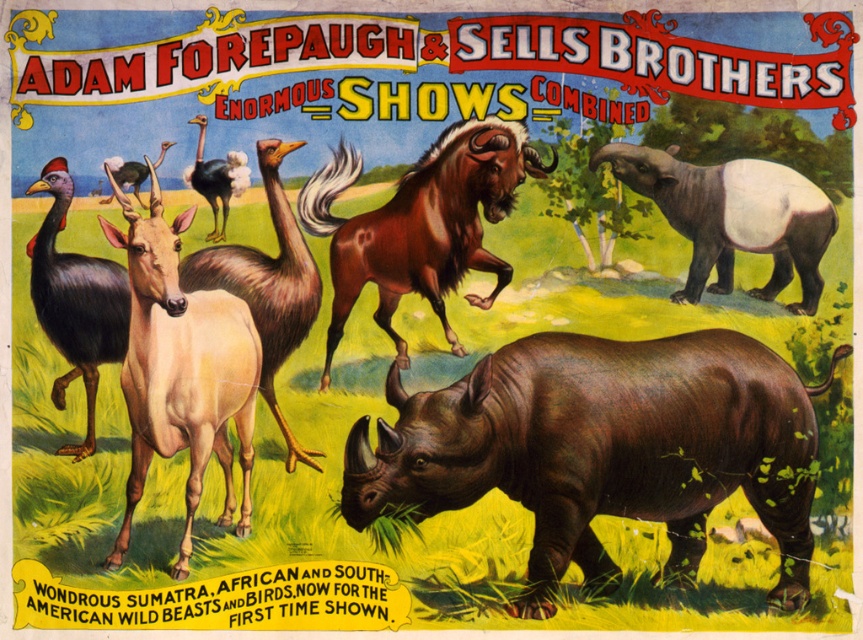
Question: Can you confirm if brown glossy rhinoceros at lower right is positioned to the right of dark brown matte rhinoceros at lower right?

Choices:
 (A) no
 (B) yes

Answer: (A)

Question: Considering the real-world distances, which object is farthest from the brown shaggy horse at center?

Choices:
 (A) dark brown matte rhinoceros at lower right
 (B) black feathered bird at left
 (C) light brown fur goat at center-left

Answer: (B)

Question: Among these points, which one is farthest from the camera?

Choices:
 (A) (662, 192)
 (B) (41, 292)
 (C) (471, 227)
 (D) (301, 273)

Answer: (D)

Question: Which of these objects is positioned farthest from the brown glossy rhinoceros at lower right?

Choices:
 (A) light brown fur goat at center-left
 (B) dark brown matte rhinoceros at lower right

Answer: (A)

Question: Is light brown fur goat at center-left closer to camera compared to black feathered bird at left?

Choices:
 (A) yes
 (B) no

Answer: (A)

Question: From the image, what is the correct spatial relationship of dark brown matte rhinoceros at lower right in relation to light brown fur goat at center-left?

Choices:
 (A) above
 (B) below

Answer: (A)